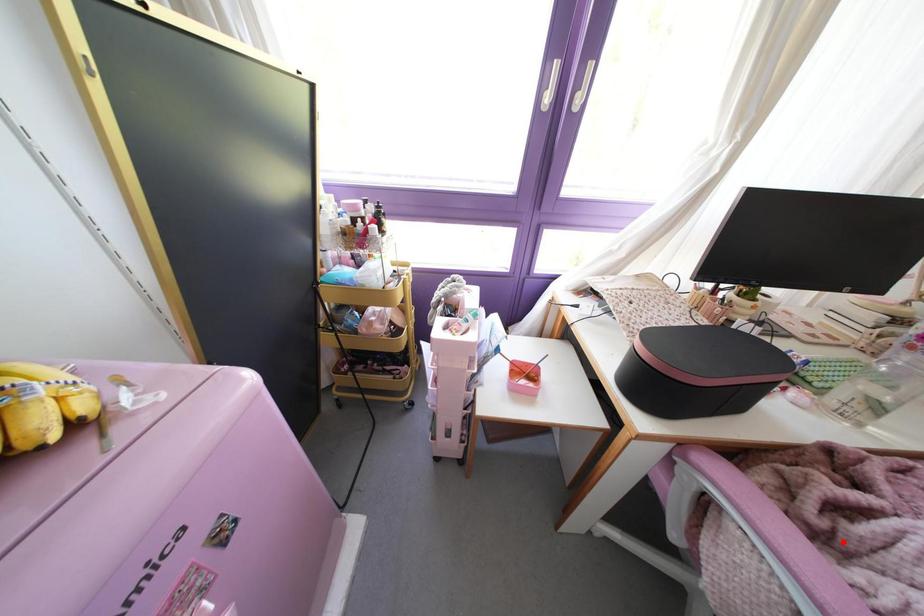
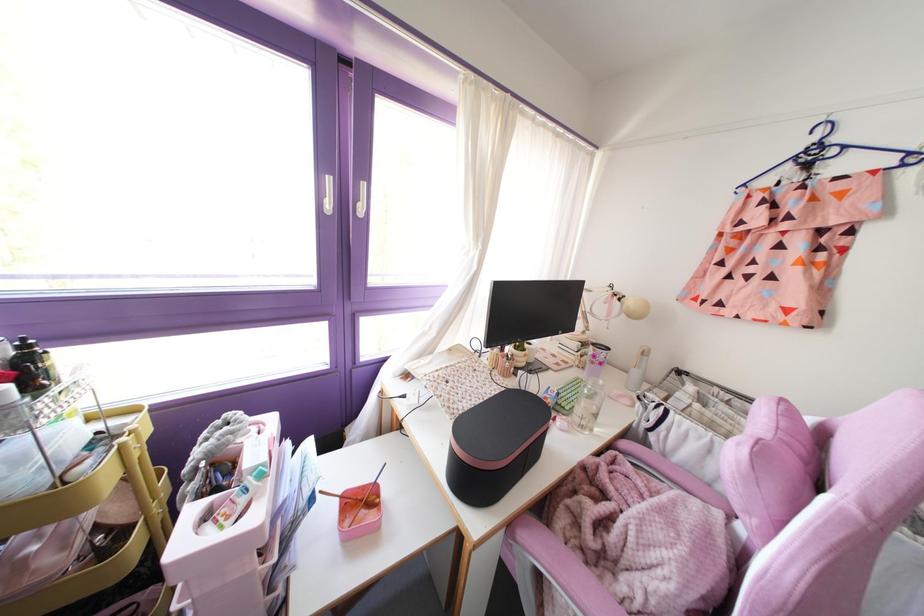
In the second image, find the point that corresponds to the highlighted location in the first image.

(610, 553)